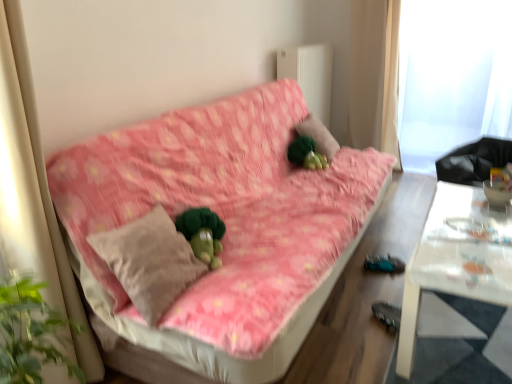
Question: Is white glossy table at right spatially inside beige fabric pillow at center, or outside of it?

Choices:
 (A) inside
 (B) outside

Answer: (B)

Question: Is point (429, 223) positioned closer to the camera than point (123, 284)?

Choices:
 (A) farther
 (B) closer

Answer: (A)

Question: Considering the real-world distances, which object is farthest from the white glossy table at right?

Choices:
 (A) white fabric curtain at upper right
 (B) pink floral fabric couch at center
 (C) green plush toy at center
 (D) transparent plastic window screen at upper right
 (E) green plush at center

Answer: (A)

Question: Considering the real-world distances, which object is farthest from the white glossy table at right?

Choices:
 (A) beige fabric pillow at center
 (B) green plush toy at center
 (C) green plush at center
 (D) white fabric curtain at upper right
 (E) pink floral fabric couch at center

Answer: (D)